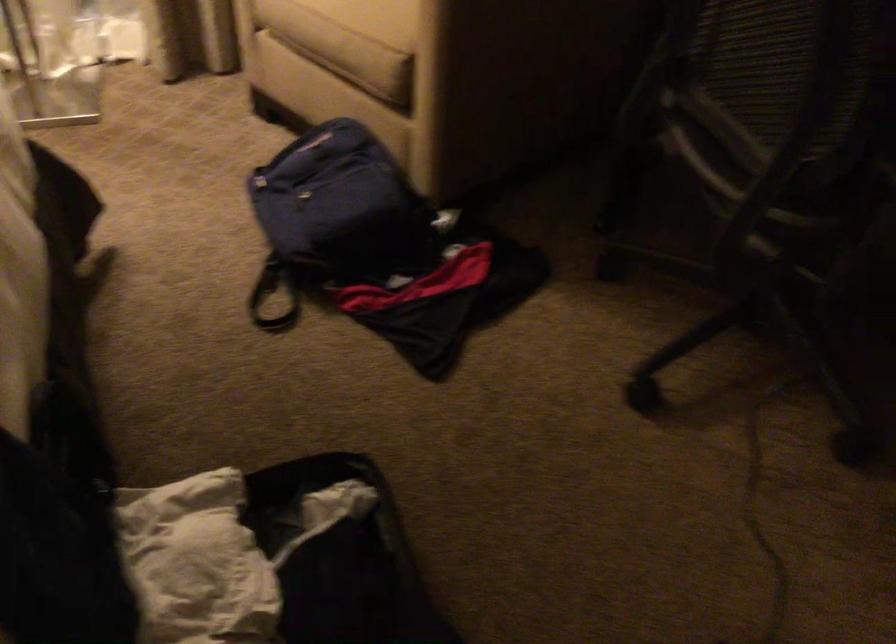
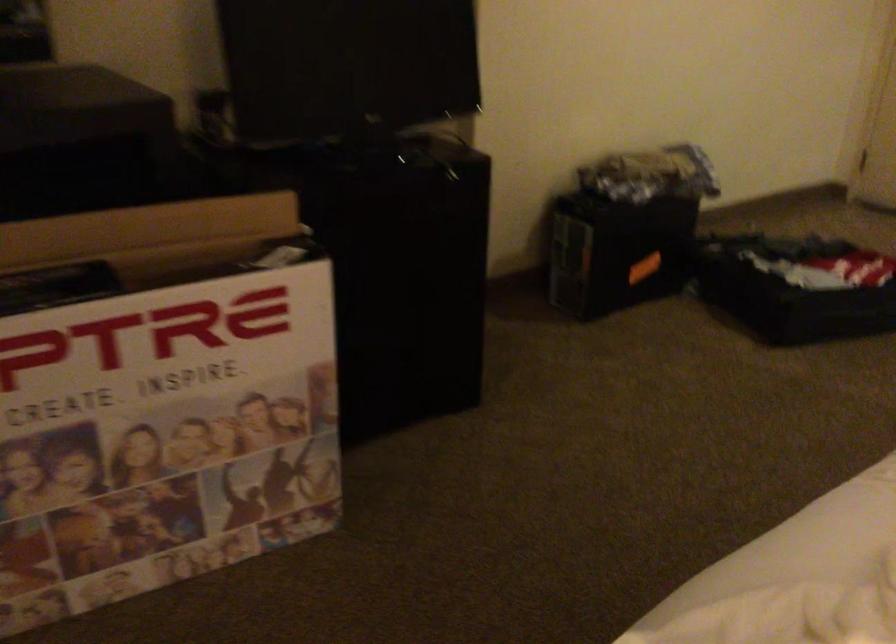
First-person continuous shooting, in which direction is the camera rotating?

The rotation direction of the camera is right-down.